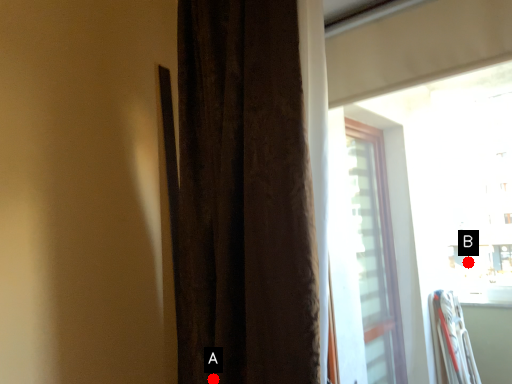
Question: Two points are circled on the image, labeled by A and B beside each circle. Which point is further to the camera?

Choices:
 (A) A is further
 (B) B is further

Answer: (B)